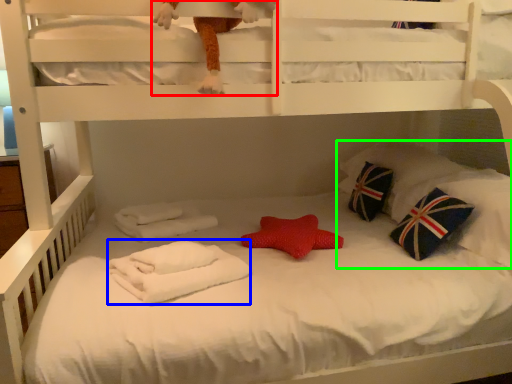
Question: Based on their relative distances, which object is nearer to toy (highlighted by a red box)? Choose from material (highlighted by a blue box) and pillow (highlighted by a green box).

Choices:
 (A) material
 (B) pillow

Answer: (A)